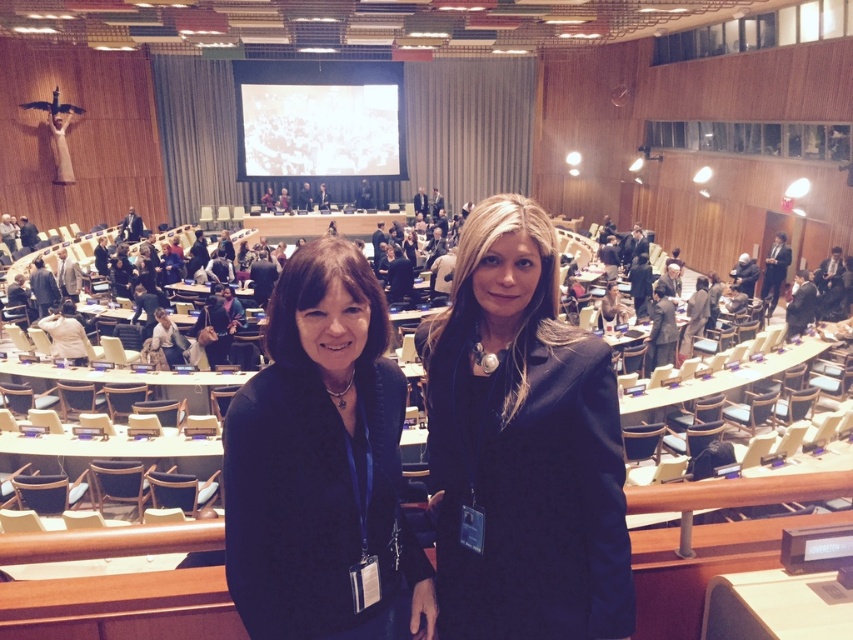
Question: Which of the following is the closest to the observer?

Choices:
 (A) black matte blazer at center
 (B) black wool coat at center

Answer: (A)

Question: Is black wool coat at center to the right of black matte blazer at center from the viewer's perspective?

Choices:
 (A) yes
 (B) no

Answer: (A)

Question: Does black wool coat at center come in front of black matte blazer at center?

Choices:
 (A) no
 (B) yes

Answer: (A)

Question: Can you confirm if black wool coat at center is thinner than black matte blazer at center?

Choices:
 (A) no
 (B) yes

Answer: (A)

Question: Which point is closer to the camera?

Choices:
 (A) (495, 388)
 (B) (238, 403)

Answer: (B)

Question: Among these objects, which one is farthest from the camera?

Choices:
 (A) black wool coat at center
 (B) black matte blazer at center

Answer: (A)